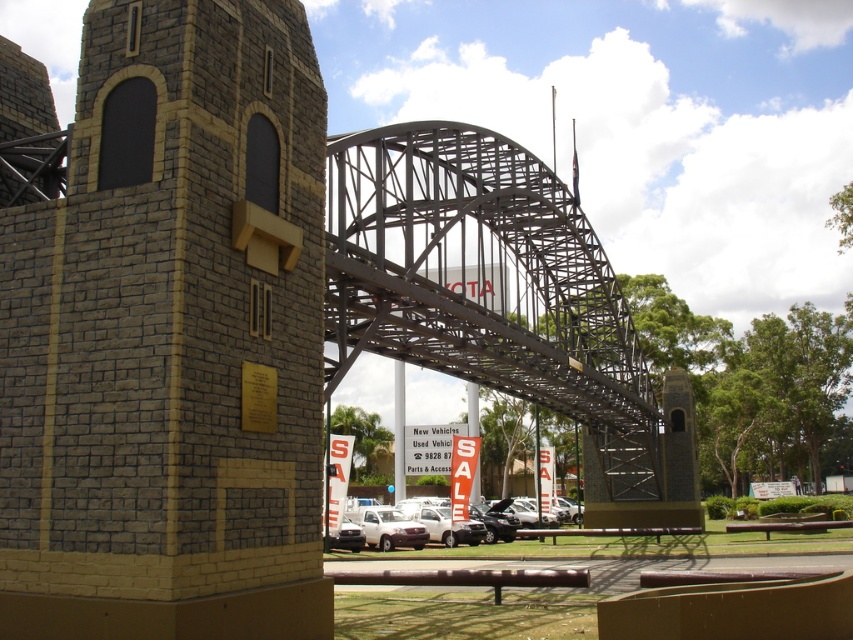
Does brick textured tower at center have a smaller size compared to white matte truck at center?

Yes, brick textured tower at center is smaller than white matte truck at center.

Is point (262, 106) positioned in front of point (461, 536)?

That is True.

The width and height of the screenshot is (853, 640). Identify the location of brick textured tower at center. (170, 337).

Who is lower down, brick textured tower at center or metallic gray bridge at center?

Positioned lower is metallic gray bridge at center.

Who is more forward, (175,449) or (451,246)?

Point (175,449)

This screenshot has height=640, width=853. What are the coordinates of `brick textured tower at center` in the screenshot? It's located at (170, 337).

Between metallic gray bridge at center and white matte truck at center, which one appears on the left side from the viewer's perspective?

white matte truck at center

How much distance is there between metallic gray bridge at center and white matte truck at center?

27.57 meters

Which is in front, point (614, 346) or point (351, 516)?

Point (614, 346)

Locate an element on the screen. The height and width of the screenshot is (640, 853). metallic gray bridge at center is located at coordinates (485, 284).